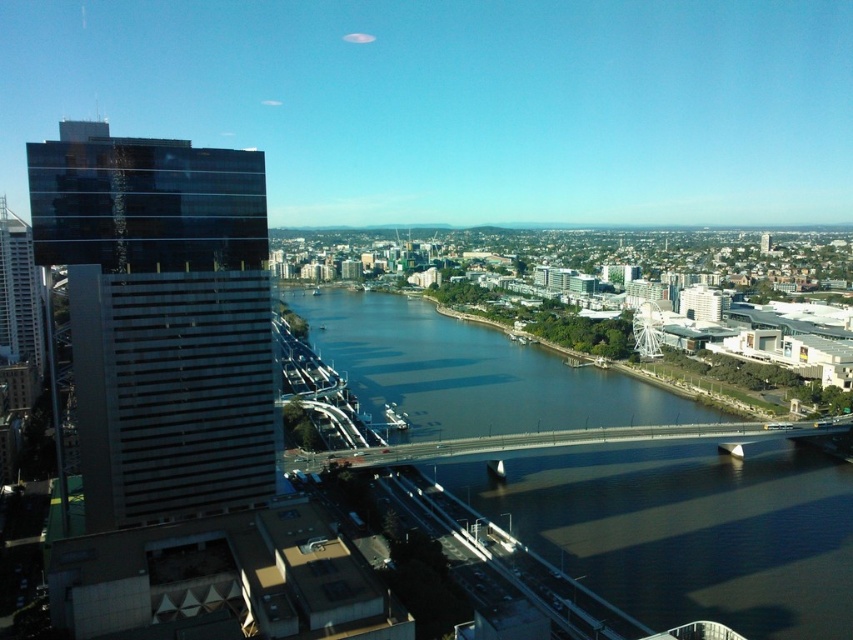
Question: Does dark blue water at center have a lesser width compared to dark glass skyscraper at left?

Choices:
 (A) yes
 (B) no

Answer: (B)

Question: Is dark blue water at center bigger than dark glass skyscraper at left?

Choices:
 (A) no
 (B) yes

Answer: (A)

Question: Among these objects, which one is nearest to the camera?

Choices:
 (A) dark glass skyscraper at left
 (B) dark blue water at center
 (C) smooth concrete bridge at center

Answer: (A)

Question: Which point is farther from the camera taking this photo?

Choices:
 (A) (518, 424)
 (B) (654, 435)
 (C) (96, 250)

Answer: (A)

Question: Among these points, which one is farthest from the camera?

Choices:
 (A) (461, 433)
 (B) (270, 294)

Answer: (A)

Question: Is dark blue water at center bigger than dark glass skyscraper at left?

Choices:
 (A) yes
 (B) no

Answer: (B)